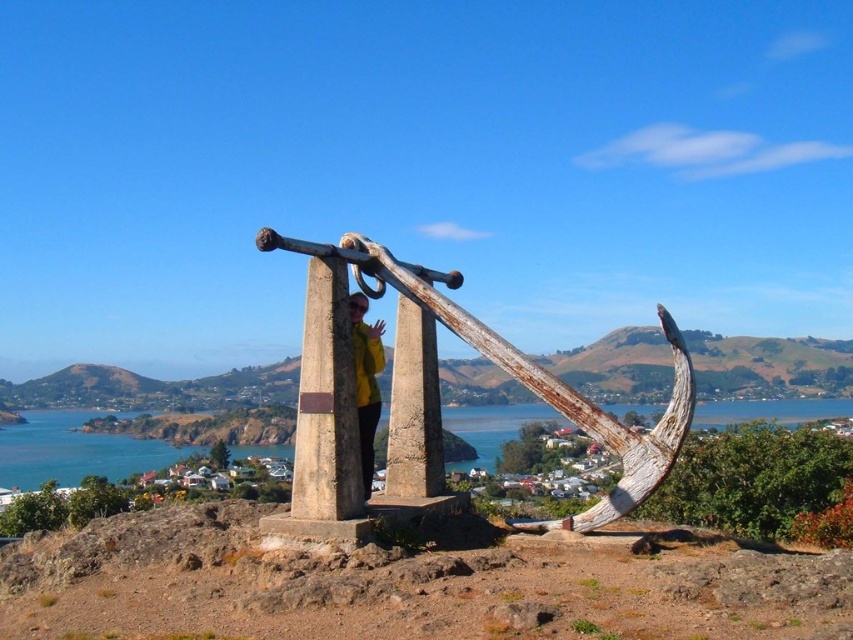
Can you confirm if blue water at center is smaller than yellow matte jacket at center?

Actually, blue water at center might be larger than yellow matte jacket at center.

Who is more forward, [67,454] or [363,435]?

Point [363,435]

Is point (88, 436) positioned after point (376, 392)?

That is True.

At what (x,y) coordinates should I click in order to perform the action: click on blue water at center. Please return your answer as a coordinate pair (x, y). Image resolution: width=853 pixels, height=640 pixels. Looking at the image, I should click on (73, 451).

Is rusty metal anchor at center further to camera compared to blue water at center?

No, rusty metal anchor at center is closer to the viewer.

Find the location of a particular element. This screenshot has width=853, height=640. rusty metal anchor at center is located at coordinates (436, 384).

Does rusty metal anchor at center have a smaller size compared to yellow matte jacket at center?

No.

Who is positioned more to the left, rusty metal anchor at center or yellow matte jacket at center?

Positioned to the left is yellow matte jacket at center.

Image resolution: width=853 pixels, height=640 pixels. What are the coordinates of `rusty metal anchor at center` in the screenshot? It's located at (436, 384).